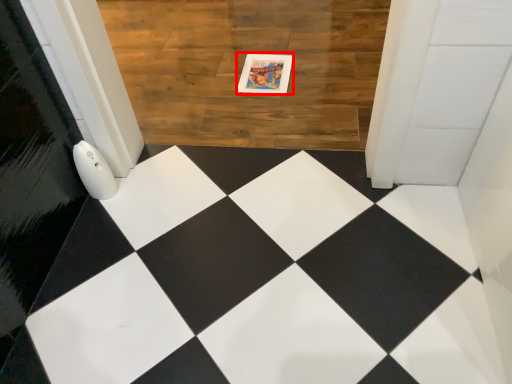
Question: From the image's perspective, where is postcard (annotated by the red box) located in relation to square in the image?

Choices:
 (A) below
 (B) above

Answer: (A)